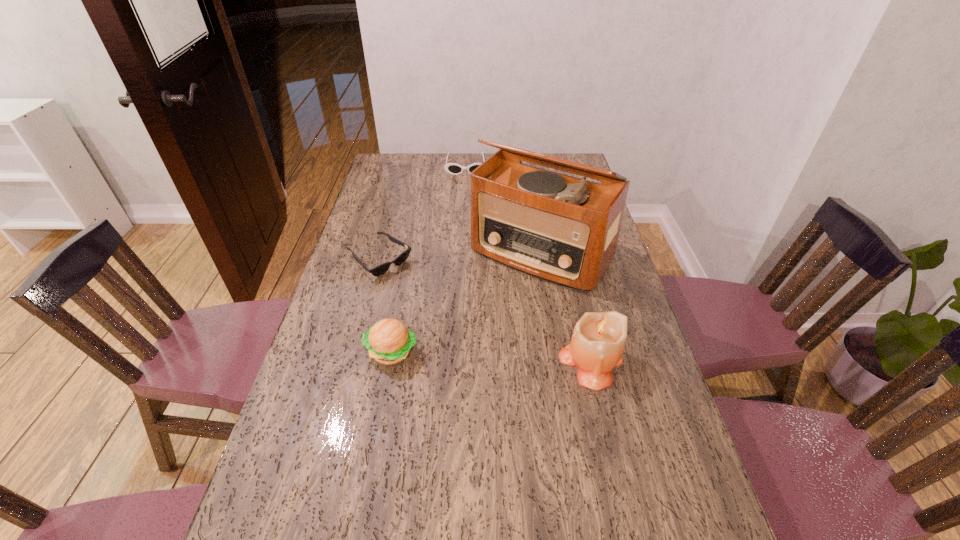
Image resolution: width=960 pixels, height=540 pixels. What are the coordinates of `free location located with the lenses of the farthest object facing outward` in the screenshot? It's located at (465, 228).

The width and height of the screenshot is (960, 540). Find the location of `vacant space located on the front-facing side of the nearer sunglasses`. vacant space located on the front-facing side of the nearer sunglasses is located at coordinates (459, 322).

At what (x,y) coordinates should I click in order to perform the action: click on vacant region located 0.280m on the front-facing side of the nearer sunglasses. Please return your answer as a coordinate pair (x, y). Looking at the image, I should click on (459, 322).

The width and height of the screenshot is (960, 540). I want to click on vacant point located 0.180m on the front-facing side of the nearer sunglasses, so click(x=436, y=305).

Image resolution: width=960 pixels, height=540 pixels. I want to click on vacant region located 0.240m on the front panel of the tallest object, so click(467, 340).

Identify the location of free point located on the front panel of the tallest object. (487, 315).

This screenshot has height=540, width=960. Find the location of `free space located 0.300m on the front panel of the tallest object`. free space located 0.300m on the front panel of the tallest object is located at coordinates (455, 355).

Where is `object that is at the far edge`? The width and height of the screenshot is (960, 540). object that is at the far edge is located at coordinates pos(452,168).

The image size is (960, 540). I want to click on hamburger that is at the left edge, so click(388, 341).

At what (x,y) coordinates should I click in order to perform the action: click on sunglasses that is at the left edge. Please return your answer as a coordinate pair (x, y). This screenshot has width=960, height=540. Looking at the image, I should click on (376, 271).